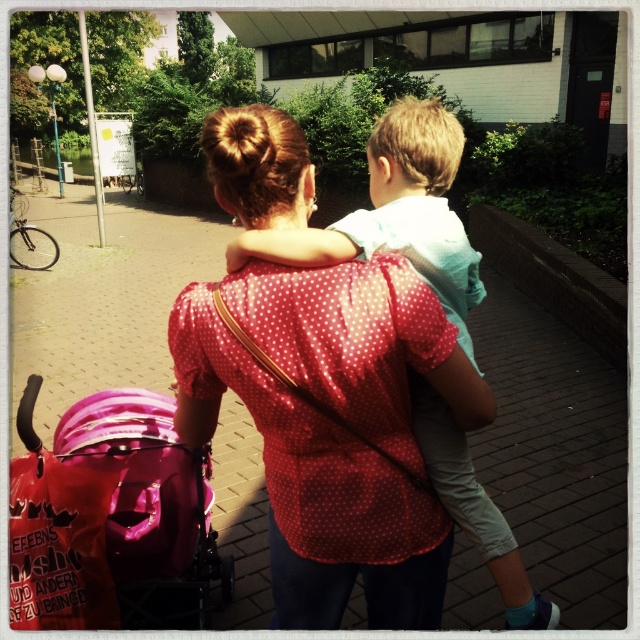
Question: Which object appears closest to the camera in this image?

Choices:
 (A) pink fabric baby carriage at lower left
 (B) brick pavement at center

Answer: (A)

Question: Which object is farther from the camera taking this photo?

Choices:
 (A) brick pavement at center
 (B) pink fabric baby carriage at lower left

Answer: (A)

Question: Can you confirm if brick pavement at center is wider than light blue cotton shirt at upper center?

Choices:
 (A) yes
 (B) no

Answer: (A)

Question: Does brick pavement at center have a smaller size compared to pink fabric baby carriage at lower left?

Choices:
 (A) no
 (B) yes

Answer: (A)

Question: Which object appears closest to the camera in this image?

Choices:
 (A) pink fabric baby carriage at lower left
 (B) light blue cotton shirt at upper center
 (C) brick pavement at center

Answer: (B)

Question: Can you confirm if pink fabric baby carriage at lower left is positioned below light blue cotton shirt at upper center?

Choices:
 (A) yes
 (B) no

Answer: (A)